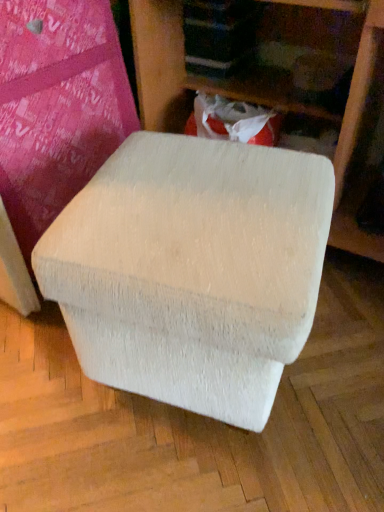
Question: Should I look upward or downward to see white textured bean bag at center?

Choices:
 (A) down
 (B) up

Answer: (A)

Question: Can you confirm if white fabric ottoman at center is wider than white textured bean bag at center?

Choices:
 (A) yes
 (B) no

Answer: (A)

Question: Is white fabric ottoman at center facing towards white textured bean bag at center?

Choices:
 (A) yes
 (B) no

Answer: (A)

Question: Is white fabric ottoman at center positioned with its back to white textured bean bag at center?

Choices:
 (A) yes
 (B) no

Answer: (B)

Question: Are white fabric ottoman at center and white textured bean bag at center far apart?

Choices:
 (A) no
 (B) yes

Answer: (A)

Question: Does white fabric ottoman at center have a greater height compared to white textured bean bag at center?

Choices:
 (A) yes
 (B) no

Answer: (A)

Question: Is white fabric ottoman at center at the right side of white textured bean bag at center?

Choices:
 (A) no
 (B) yes

Answer: (B)

Question: Considering the relative sizes of white textured bean bag at center and white fabric ottoman at center in the image provided, is white textured bean bag at center smaller than white fabric ottoman at center?

Choices:
 (A) no
 (B) yes

Answer: (B)

Question: Does white textured bean bag at center have a lesser width compared to white fabric ottoman at center?

Choices:
 (A) yes
 (B) no

Answer: (A)

Question: Considering the relative positions of white textured bean bag at center and white fabric ottoman at center in the image provided, is white textured bean bag at center to the right of white fabric ottoman at center from the viewer's perspective?

Choices:
 (A) yes
 (B) no

Answer: (B)

Question: Is white fabric ottoman at center at the back of white textured bean bag at center?

Choices:
 (A) no
 (B) yes

Answer: (B)

Question: Is white textured bean bag at center behind white fabric ottoman at center?

Choices:
 (A) yes
 (B) no

Answer: (B)

Question: Can you confirm if white textured bean bag at center is positioned to the left of white fabric ottoman at center?

Choices:
 (A) yes
 (B) no

Answer: (A)

Question: In the image, is white textured bean bag at center positioned in front of or behind white fabric ottoman at center?

Choices:
 (A) front
 (B) behind

Answer: (A)